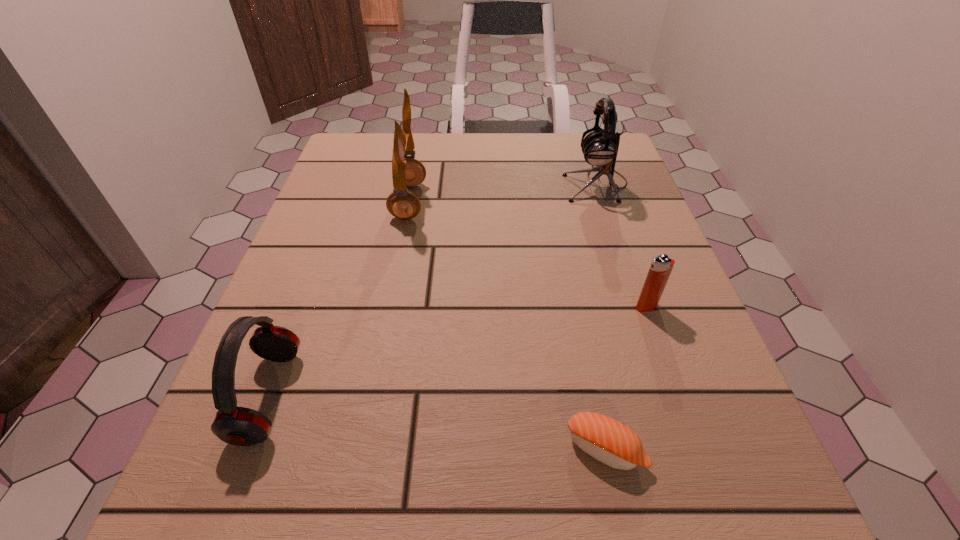
What are the coordinates of `vacant space at the right edge` in the screenshot? It's located at (614, 339).

Identify the location of vacant point at the far left corner. (374, 151).

Where is `empty space between the third shortest object and the shortest object`? empty space between the third shortest object and the shortest object is located at coordinates (437, 422).

Where is `vacant area that lies between the igniter and the second object from left to right`? vacant area that lies between the igniter and the second object from left to right is located at coordinates (528, 254).

Find the location of a particular element. This screenshot has height=540, width=960. empty space that is in between the second earphone from right to left and the shortest object is located at coordinates (507, 325).

Identify the location of empty location between the rightmost earphone and the leftmost earphone. Image resolution: width=960 pixels, height=540 pixels. (432, 290).

I want to click on free space between the rightmost earphone and the igniter, so click(x=621, y=245).

Identify the location of vacant space that is in between the sushi and the igniter. (626, 377).

At what (x,y) coordinates should I click in order to perform the action: click on free space between the rightmost earphone and the shortest earphone. Please return your answer as a coordinate pair (x, y). This screenshot has height=540, width=960. Looking at the image, I should click on (432, 290).

Find the location of a particular element. empty location between the rightmost earphone and the igniter is located at coordinates (621, 245).